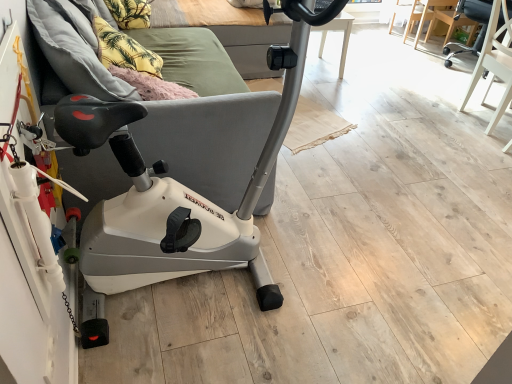
Identify the location of free point to the left of black leather swivel chair at upper right, which is the 2th swivel chair in back-to-front order. The height and width of the screenshot is (384, 512). (430, 112).